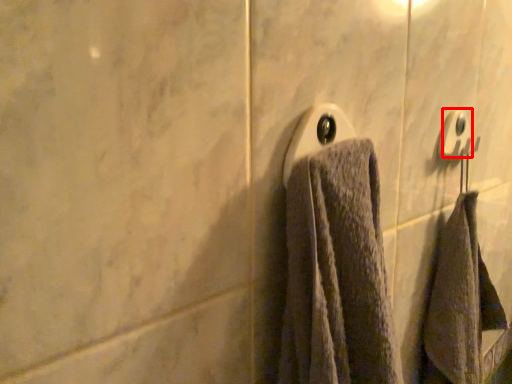
Question: From the image's perspective, where is towel bar (annotated by the red box) located in relation to towel bar in the image?

Choices:
 (A) below
 (B) above

Answer: (B)